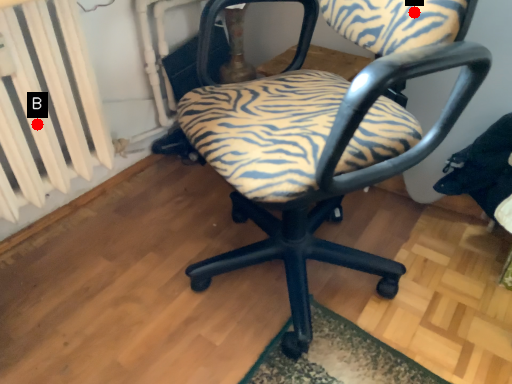
Question: Two points are circled on the image, labeled by A and B beside each circle. Which of the following is the closest to the observer?

Choices:
 (A) A is closer
 (B) B is closer

Answer: (A)